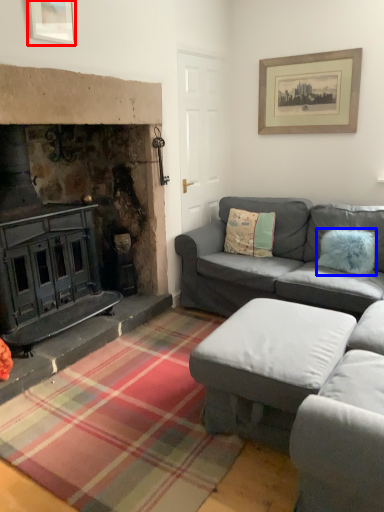
Question: Which object is further to the camera taking this photo, picture frame (highlighted by a red box) or pillow (highlighted by a blue box)?

Choices:
 (A) picture frame
 (B) pillow

Answer: (B)